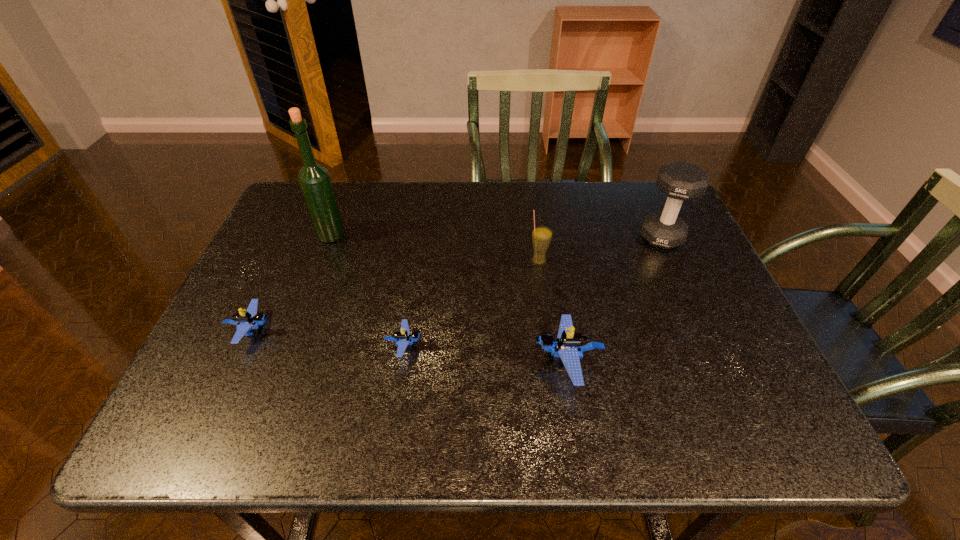
Identify the location of free area in between the fifth tallest object and the tallest Lego. Image resolution: width=960 pixels, height=540 pixels. (410, 346).

You are a GUI agent. You are given a task and a screenshot of the screen. Output one action in this format:
    pyautogui.click(x=<x>, y=<y>)
    Task: Click on the vacant space that is in between the rightmost Lego and the second shortest object
    The width and height of the screenshot is (960, 540).
    Given the screenshot: What is the action you would take?
    pyautogui.click(x=410, y=346)

Locate an element on the screen. the third closest object to the second shortest Lego is located at coordinates (569, 345).

I want to click on object that is the fourth nearest to the shortest Lego, so click(x=314, y=180).

Identify the location of Lego that is the third closest to the dumbbell. click(x=251, y=319).

You are a GUI agent. You are given a task and a screenshot of the screen. Output one action in this format:
    pyautogui.click(x=<x>, y=<y>)
    Task: Click on the Lego that is the closest one to the fifth tallest object
    
    Given the screenshot: What is the action you would take?
    [402, 338]

Find the location of a particular element. The image size is (960, 540). blank space that satisfies the following two spatial constraints: 1. on the front side of the fourth nearest object; 2. on the front-facing side of the shortest Lego is located at coordinates (550, 346).

The image size is (960, 540). I want to click on free spot that satisfies the following two spatial constraints: 1. on the front side of the rightmost object; 2. on the front-facing side of the rightmost Lego, so click(718, 362).